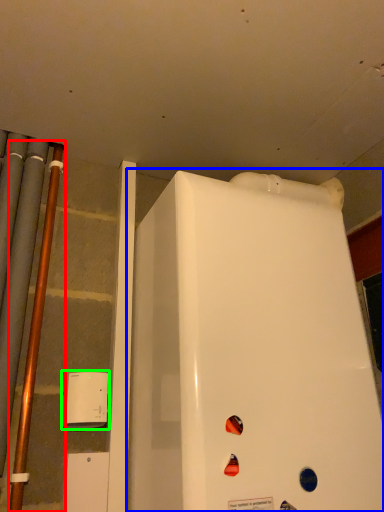
Question: Considering the real-world distances, which object is farthest from pipe (highlighted by a red box)? refrigerator (highlighted by a blue box) or appliance (highlighted by a green box)?

Choices:
 (A) refrigerator
 (B) appliance

Answer: (A)